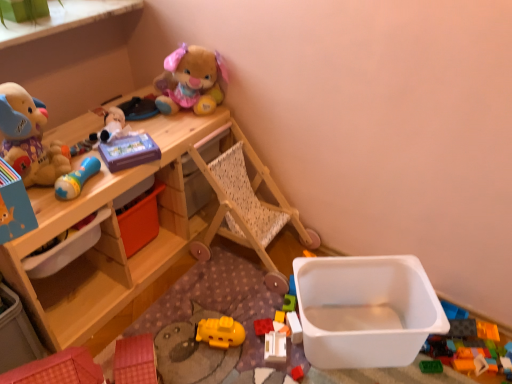
You are a GUI agent. You are given a task and a screenshot of the screen. Output one action in this format:
    pyautogui.click(x=<x>, y=<y>)
    Task: Click on the vacant area that lies in front of wooden baby carriage at center
    
    Given the screenshot: What is the action you would take?
    pyautogui.click(x=228, y=316)